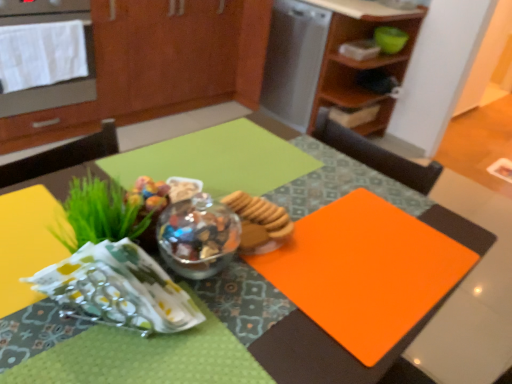
Question: Is satin silver dishwasher at upper center wider than orange matte placemat at center?

Choices:
 (A) no
 (B) yes

Answer: (B)

Question: From the image's perspective, is satin silver dishwasher at upper center on orange matte placemat at center?

Choices:
 (A) yes
 (B) no

Answer: (A)

Question: Is satin silver dishwasher at upper center shorter than orange matte placemat at center?

Choices:
 (A) no
 (B) yes

Answer: (A)

Question: Can you confirm if satin silver dishwasher at upper center is bigger than orange matte placemat at center?

Choices:
 (A) yes
 (B) no

Answer: (A)

Question: From a real-world perspective, is satin silver dishwasher at upper center located higher than orange matte placemat at center?

Choices:
 (A) yes
 (B) no

Answer: (B)

Question: Is satin silver dishwasher at upper center thinner than orange matte placemat at center?

Choices:
 (A) no
 (B) yes

Answer: (A)

Question: Is matte wood cabinetry at upper center, which is the 2th cabinetry in right-to-left order, smaller than teal bowl at upper right?

Choices:
 (A) yes
 (B) no

Answer: (B)

Question: Does matte wood cabinetry at upper center, which is the 2th cabinetry in right-to-left order, touch teal bowl at upper right?

Choices:
 (A) no
 (B) yes

Answer: (A)

Question: Considering the relative sizes of matte wood cabinetry at upper center, the first cabinetry viewed from the left, and teal bowl at upper right in the image provided, is matte wood cabinetry at upper center, the first cabinetry viewed from the left, bigger than teal bowl at upper right?

Choices:
 (A) no
 (B) yes

Answer: (B)

Question: Could you tell me if matte wood cabinetry at upper center, which is the 2th cabinetry in right-to-left order, is facing teal bowl at upper right?

Choices:
 (A) yes
 (B) no

Answer: (A)

Question: Is matte wood cabinetry at upper center, the first cabinetry viewed from the left, not close to teal bowl at upper right?

Choices:
 (A) yes
 (B) no

Answer: (A)

Question: Can we say matte wood cabinetry at upper center, which is the 2th cabinetry in right-to-left order, lies outside teal bowl at upper right?

Choices:
 (A) no
 (B) yes

Answer: (B)

Question: Can you confirm if orange matte placemat at center is smaller than wooden cabinet at upper right, the first cabinetry in the right-to-left sequence?

Choices:
 (A) no
 (B) yes

Answer: (B)